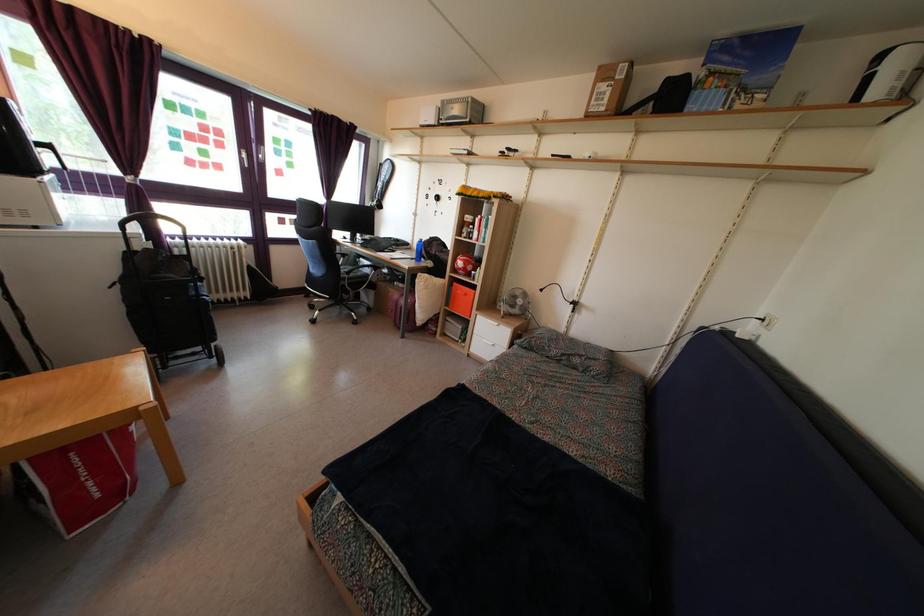
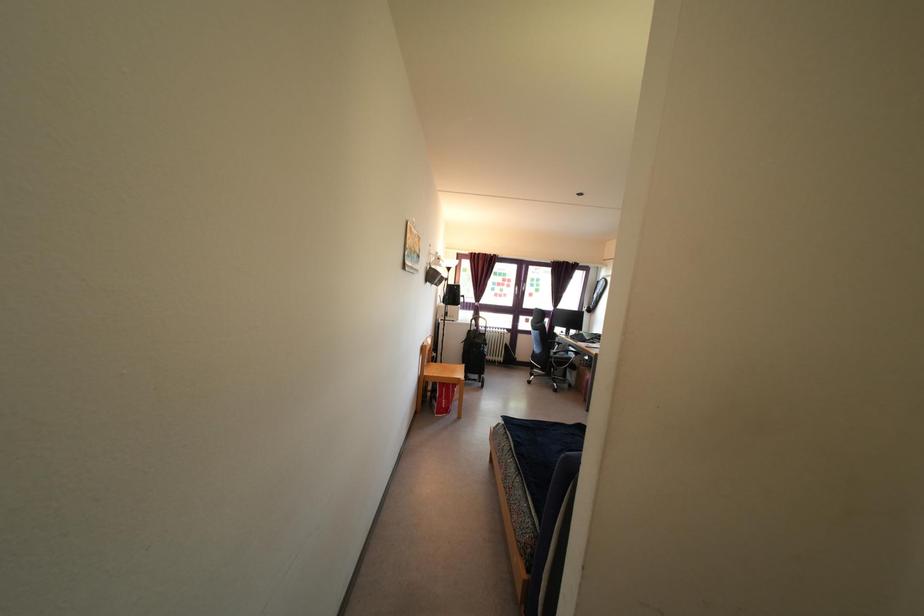
The point at (x=350, y=282) is marked in the first image. Where is the corresponding point in the second image?

(557, 362)